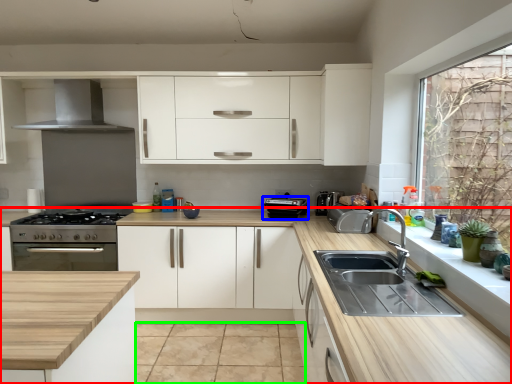
Question: Which is farther away from countertop (highlighted by a red box)? appliance (highlighted by a blue box) or tile (highlighted by a green box)?

Choices:
 (A) appliance
 (B) tile

Answer: (B)